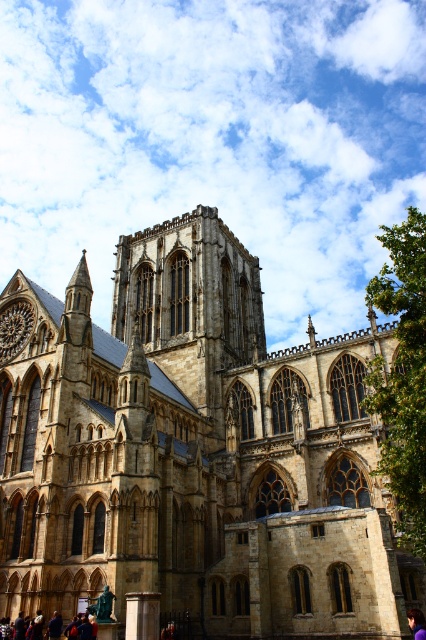
Question: Does brown stone church at center lie behind purple fabric at lower right?

Choices:
 (A) yes
 (B) no

Answer: (B)

Question: Among these points, which one is farthest from the camera?

Choices:
 (A) tap(6, 522)
 (B) tap(408, 616)

Answer: (A)

Question: Can you confirm if brown stone church at center is smaller than purple fabric at lower right?

Choices:
 (A) no
 (B) yes

Answer: (A)

Question: Which object is closer to the camera taking this photo?

Choices:
 (A) brown stone church at center
 (B) purple fabric at lower right

Answer: (A)

Question: Which object is farther from the camera taking this photo?

Choices:
 (A) purple fabric at lower right
 (B) brown stone church at center

Answer: (A)

Question: Is brown stone church at center below purple fabric at lower right?

Choices:
 (A) yes
 (B) no

Answer: (B)